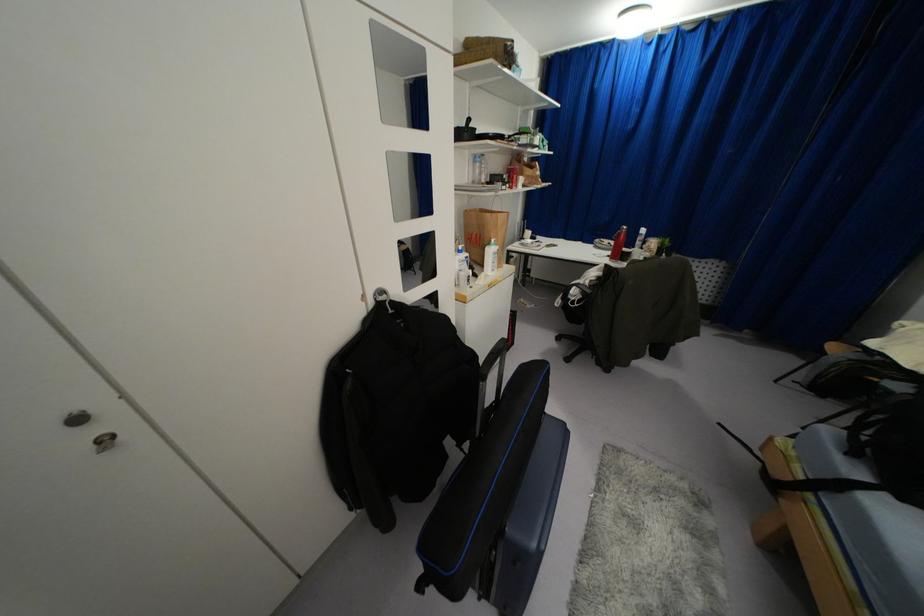
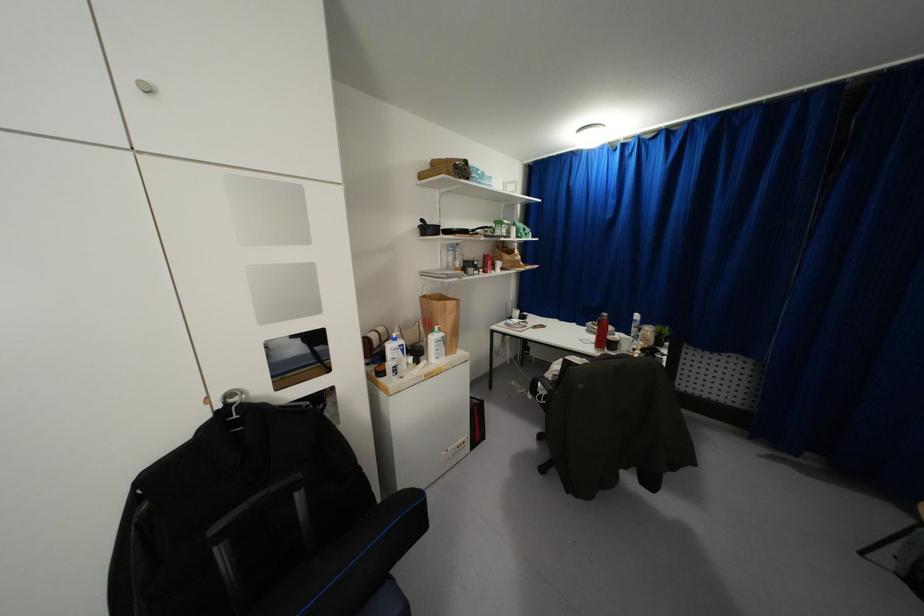
In the second image, find the point that corresponds to the point at 495,246 in the first image.

(442, 333)